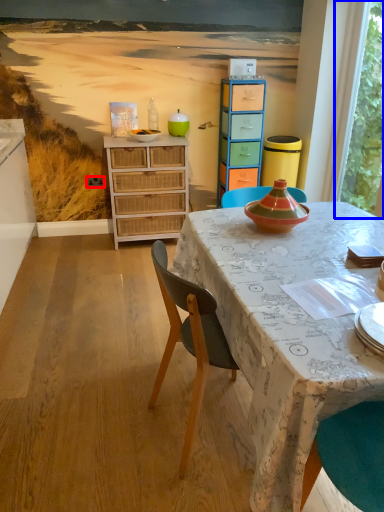
Question: Which of the following is the closest to the observer, power outlet (highlighted by a red box) or window screen (highlighted by a blue box)?

Choices:
 (A) power outlet
 (B) window screen

Answer: (B)